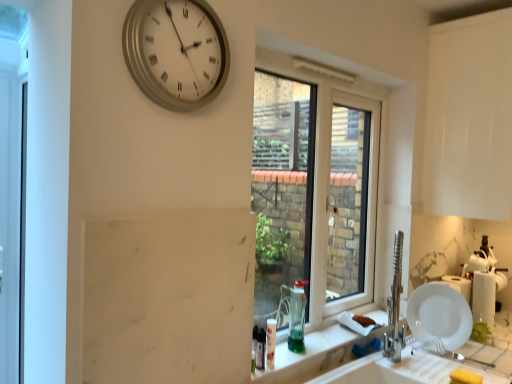
Question: Does white glossy plate at lower right turn towards green glass bottle at window?

Choices:
 (A) yes
 (B) no

Answer: (A)

Question: Is the depth of white glossy plate at lower right greater than that of green glass bottle at window?

Choices:
 (A) yes
 (B) no

Answer: (A)

Question: From a real-world perspective, is white glossy plate at lower right over green glass bottle at window?

Choices:
 (A) yes
 (B) no

Answer: (B)

Question: Considering the relative positions of white glossy plate at lower right and green glass bottle at window in the image provided, is white glossy plate at lower right to the left of green glass bottle at window from the viewer's perspective?

Choices:
 (A) yes
 (B) no

Answer: (B)

Question: From the image's perspective, is white glossy plate at lower right beneath green glass bottle at window?

Choices:
 (A) yes
 (B) no

Answer: (A)

Question: Is white glossy plate at lower right turned away from green glass bottle at window?

Choices:
 (A) no
 (B) yes

Answer: (A)

Question: Does green glass at lower center appear on the right side of silver metallic clock at upper center?

Choices:
 (A) no
 (B) yes

Answer: (B)

Question: From a real-world perspective, is green glass at lower center located beneath silver metallic clock at upper center?

Choices:
 (A) yes
 (B) no

Answer: (A)

Question: Considering the relative sizes of green glass at lower center and silver metallic clock at upper center in the image provided, is green glass at lower center taller than silver metallic clock at upper center?

Choices:
 (A) no
 (B) yes

Answer: (A)

Question: Can you confirm if green glass at lower center is thinner than silver metallic clock at upper center?

Choices:
 (A) yes
 (B) no

Answer: (B)

Question: Is green glass at lower center placed right next to silver metallic clock at upper center?

Choices:
 (A) yes
 (B) no

Answer: (B)

Question: From the image's perspective, is green glass at lower center beneath silver metallic clock at upper center?

Choices:
 (A) yes
 (B) no

Answer: (A)

Question: Can you confirm if green glass at lower center is shorter than white glossy plate at lower right?

Choices:
 (A) no
 (B) yes

Answer: (B)